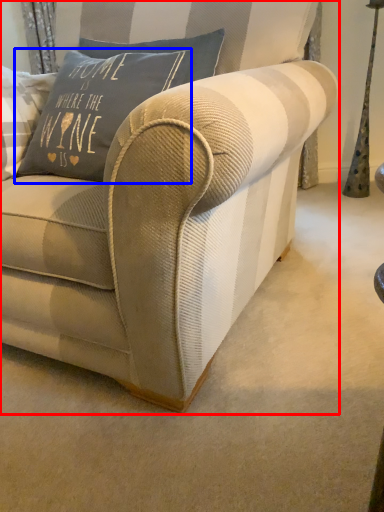
Question: Which object is closer to the camera taking this photo, studio couch (highlighted by a red box) or pillow (highlighted by a blue box)?

Choices:
 (A) studio couch
 (B) pillow

Answer: (A)